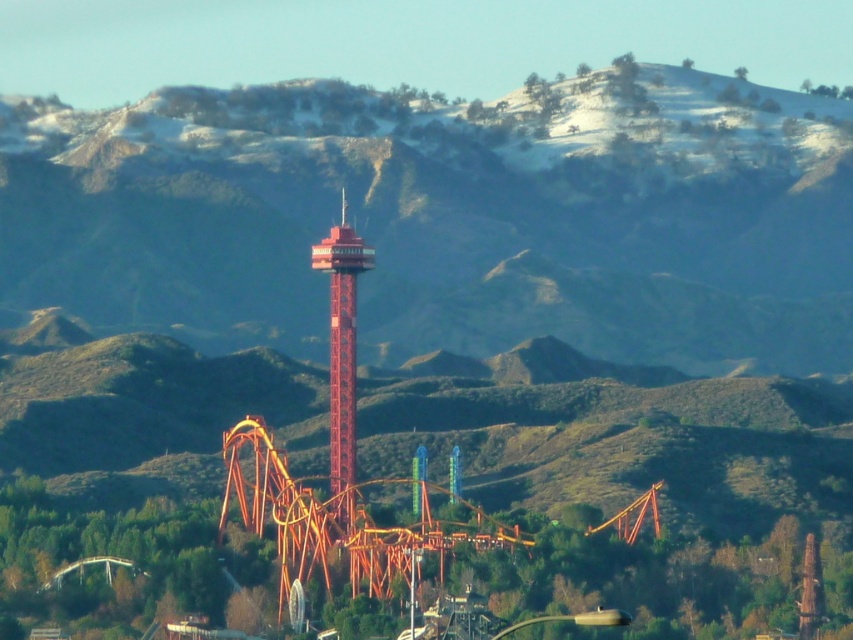
Question: Is smooth brown mountain at center to the right of smooth red tower at center from the viewer's perspective?

Choices:
 (A) no
 (B) yes

Answer: (B)

Question: Can you confirm if smooth brown mountain at center is positioned above smooth red tower at center?

Choices:
 (A) yes
 (B) no

Answer: (A)

Question: Which of the following is the farthest from the observer?

Choices:
 (A) smooth red tower at center
 (B) smooth brown mountain at center

Answer: (A)

Question: Does smooth brown mountain at center have a greater width compared to smooth red tower at center?

Choices:
 (A) no
 (B) yes

Answer: (B)

Question: Which point appears closest to the camera in this image?

Choices:
 (A) (341, 285)
 (B) (381, 280)

Answer: (A)